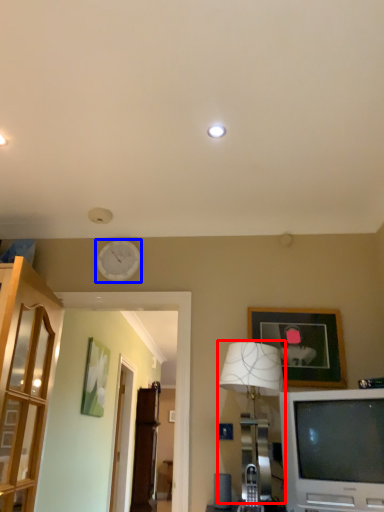
Question: Among these objects, which one is nearest to the camera, lamp (highlighted by a red box) or clock (highlighted by a blue box)?

Choices:
 (A) lamp
 (B) clock

Answer: (A)